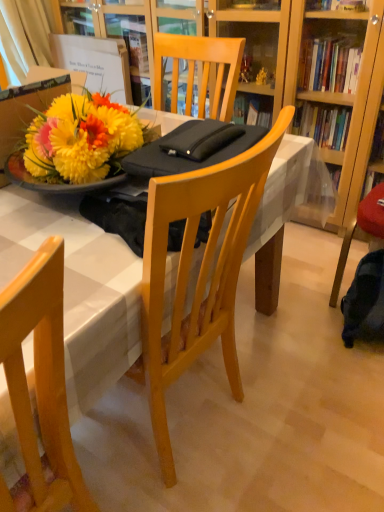
At what (x,y) coordinates should I click in order to perform the action: click on white fabric curtain at upper left. Please return your answer as a coordinate pair (x, y). The image size is (384, 512). Looking at the image, I should click on (24, 37).

Find the location of a particular element. This screenshot has height=512, width=384. white glossy table at center is located at coordinates (79, 290).

Describe the element at coordinates (79, 290) in the screenshot. I see `white glossy table at center` at that location.

You are a GUI agent. You are given a task and a screenshot of the screen. Output one action in this format:
    pyautogui.click(x=<x>, y=<y>)
    Task: Click on the light wood chair at lower left
    Image resolution: width=384 pixels, height=512 pixels.
    Given the screenshot: What is the action you would take?
    pyautogui.click(x=40, y=387)

Considering the points (17, 357) and (51, 214), which point is in front, point (17, 357) or point (51, 214)?

Positioned in front is point (17, 357).

You are a GUI agent. You are given a task and a screenshot of the screen. Output one action in this format:
    pyautogui.click(x=<x>, y=<y>)
    Task: Click on the chair that is in front of the white glossy table at center
    
    Given the screenshot: What is the action you would take?
    (40, 387)

How far apart are light wood chair at lower left and white glossy table at center?

light wood chair at lower left and white glossy table at center are 4.81 inches apart.

What's the angular difference between light wood chair at lower left and white glossy table at center's facing directions?

There is a 0.0486-degree angle between the facing directions of light wood chair at lower left and white glossy table at center.

Does white glossy table at center have a smaller size compared to light wood chair at lower left?

No.

Which point is more distant from viewer, (218,243) or (42,291)?

The point (218,243) is more distant.

How distant is white glossy table at center from light wood chair at lower left?

white glossy table at center is 4.81 inches away from light wood chair at lower left.

From the image's perspective, is white glossy table at center below light wood chair at lower left?

No, from the image's perspective, white glossy table at center is not below light wood chair at lower left.

Is the depth of white glossy table at center less than that of white fabric curtain at upper left?

Yes, white glossy table at center is in front of white fabric curtain at upper left.

Which of these two, white glossy table at center or white fabric curtain at upper left, is bigger?

white glossy table at center.

From a real-world perspective, does white glossy table at center stand above white fabric curtain at upper left?

No, from a real-world perspective, white glossy table at center is not on top of white fabric curtain at upper left.

Does point (84, 231) come closer to viewer compared to point (45, 32)?

Yes, point (84, 231) is in front of point (45, 32).

From the image's perspective, between white fabric curtain at upper left and light wood chair at lower left, who is located below?

light wood chair at lower left is shown below in the image.

Can you see white fabric curtain at upper left touching light wood chair at lower left?

No, white fabric curtain at upper left is not next to light wood chair at lower left.

Who is taller, white fabric curtain at upper left or light wood chair at lower left?

light wood chair at lower left.

Considering the relative sizes of white fabric curtain at upper left and light wood chair at lower left in the image provided, is white fabric curtain at upper left bigger than light wood chair at lower left?

Actually, white fabric curtain at upper left might be smaller than light wood chair at lower left.

Would you consider light wood chair at lower left to be distant from white fabric curtain at upper left?

Yes, light wood chair at lower left is far from white fabric curtain at upper left.

Is light wood chair at lower left behind white fabric curtain at upper left?

No, light wood chair at lower left is closer to the viewer.

Does light wood chair at lower left have a lesser height compared to white fabric curtain at upper left?

No, light wood chair at lower left is not shorter than white fabric curtain at upper left.

Considering the relative sizes of light wood chair at lower left and white fabric curtain at upper left in the image provided, is light wood chair at lower left wider than white fabric curtain at upper left?

Indeed, light wood chair at lower left has a greater width compared to white fabric curtain at upper left.

Is white fabric curtain at upper left wider than white glossy table at center?

No.

From the image's perspective, does white fabric curtain at upper left appear lower than white glossy table at center?

Actually, white fabric curtain at upper left appears above white glossy table at center in the image.

How far apart are white fabric curtain at upper left and white glossy table at center?

white fabric curtain at upper left and white glossy table at center are 5.84 feet apart.

Is the surface of white fabric curtain at upper left in direct contact with white glossy table at center?

white fabric curtain at upper left is not next to white glossy table at center, and they're not touching.

Where is `desk directly beneath the light wood chair at lower left (from a real-world perspective)`? The width and height of the screenshot is (384, 512). desk directly beneath the light wood chair at lower left (from a real-world perspective) is located at coordinates (79, 290).

Where is `desk to the right of light wood chair at lower left`? This screenshot has width=384, height=512. desk to the right of light wood chair at lower left is located at coordinates (79, 290).

Considering their positions, is white fabric curtain at upper left positioned closer to light wood chair at lower left than white glossy table at center?

white glossy table at center is closer to light wood chair at lower left.

Looking at this image, looking at the image, which one is located closer to white fabric curtain at upper left, light wood chair at lower left or white glossy table at center?

Based on the image, white glossy table at center appears to be nearer to white fabric curtain at upper left.

Based on the photo, estimate the real-world distances between objects in this image. Which object is closer to white fabric curtain at upper left, white glossy table at center or light wood chair at lower left?

white glossy table at center.

From the image, which object appears to be farther from white glossy table at center, light wood chair at lower left or white fabric curtain at upper left?

Among the two, white fabric curtain at upper left is located further to white glossy table at center.

Estimate the real-world distances between objects in this image. Which object is closer to light wood chair at lower left, white glossy table at center or white fabric curtain at upper left?

white glossy table at center.

Based on their spatial positions, is white fabric curtain at upper left or light wood chair at lower left closer to white glossy table at center?

The object closer to white glossy table at center is light wood chair at lower left.

At what (x,y) coordinates should I click in order to perform the action: click on desk between light wood chair at lower left and white fabric curtain at upper left from front to back. Please return your answer as a coordinate pair (x, y). Looking at the image, I should click on (79, 290).